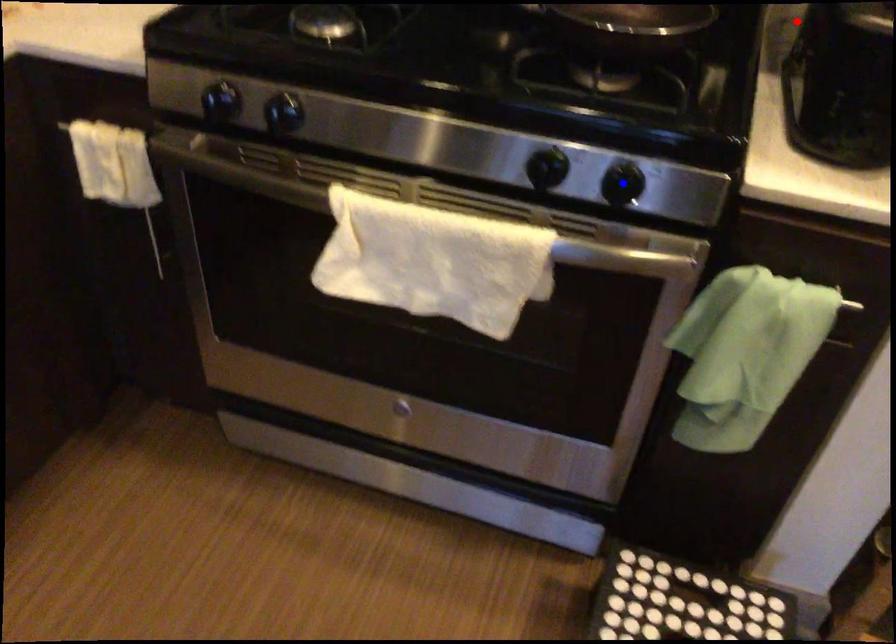
Question: Two points are marked on the image. Which point is closer to the camera?

Choices:
 (A) Blue point is closer.
 (B) Red point is closer.

Answer: (A)